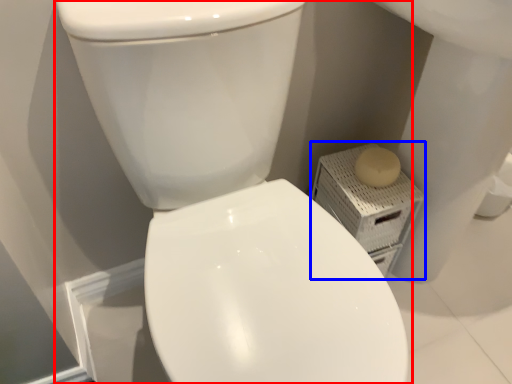
Question: Which point is further to the camera, toilet (highlighted by a red box) or porcelain (highlighted by a blue box)?

Choices:
 (A) toilet
 (B) porcelain

Answer: (B)